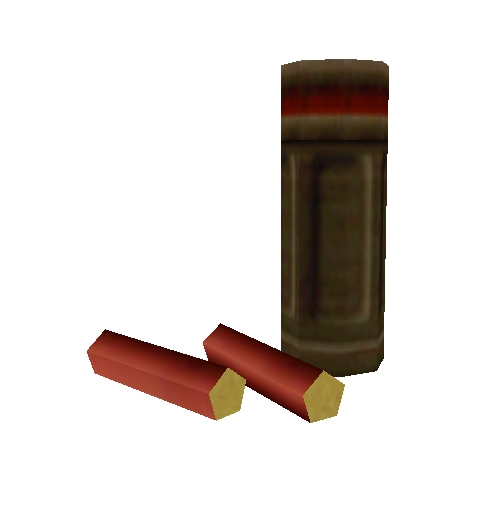
Find the location of a particular element. The width and height of the screenshot is (504, 512). the top edge of picture is located at coordinates (230, 14).